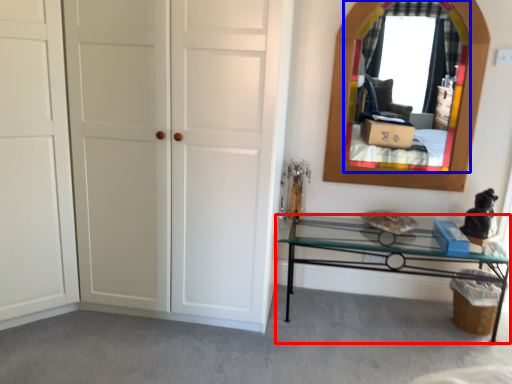
Question: Which of the following is the farthest to the observer, table (highlighted by a red box) or mirror (highlighted by a blue box)?

Choices:
 (A) table
 (B) mirror

Answer: (B)